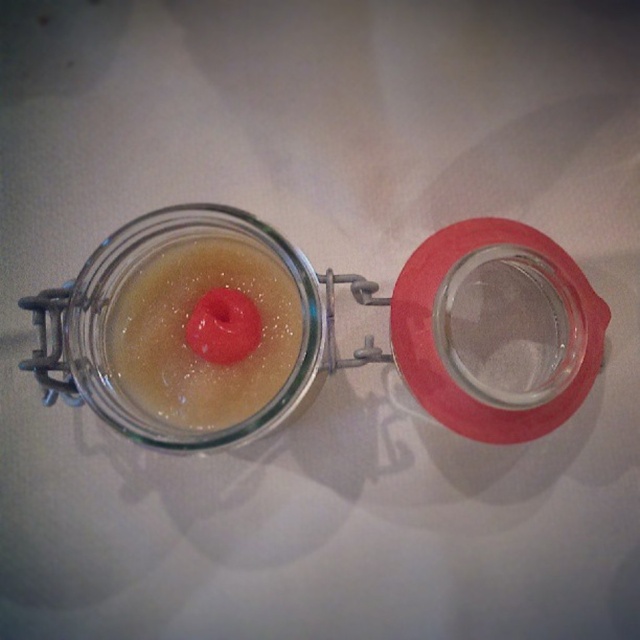
I want to click on translucent gelatinous substance at center, so click(x=205, y=332).

Between point (204, 241) and point (147, 221), which one is positioned behind?

Positioned behind is point (204, 241).

Where is `translucent gelatinous substance at center`? The height and width of the screenshot is (640, 640). translucent gelatinous substance at center is located at coordinates (205, 332).